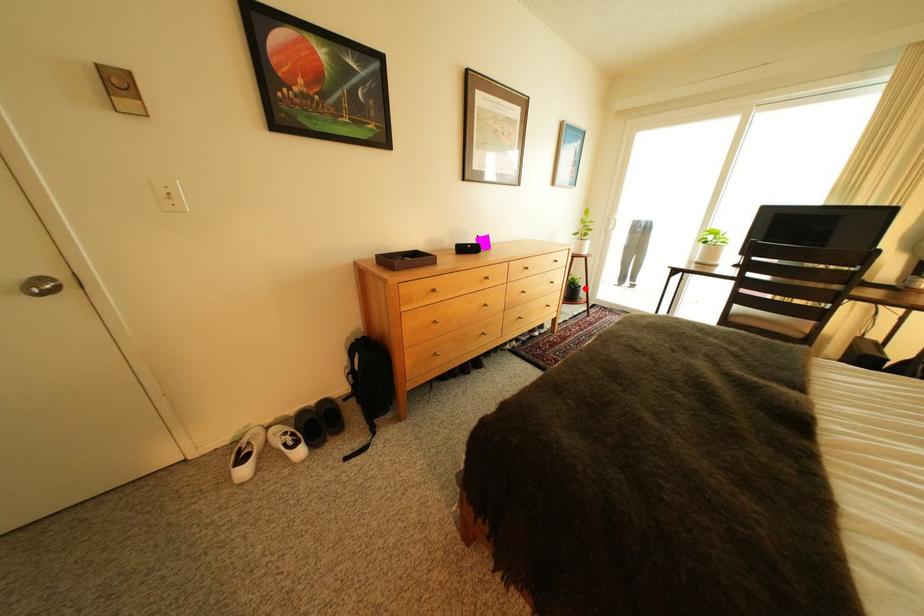
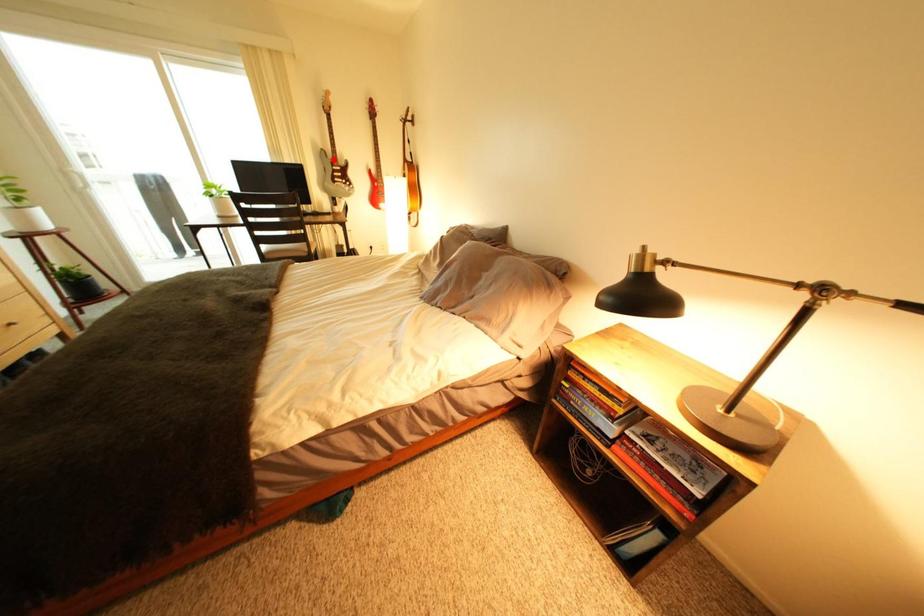
I am providing you with two images of the same scene from different viewpoints. A red point is marked on the first image and another point is marked on the second image. Is the marked point in image1 the same physical position as the marked point in image2?

No